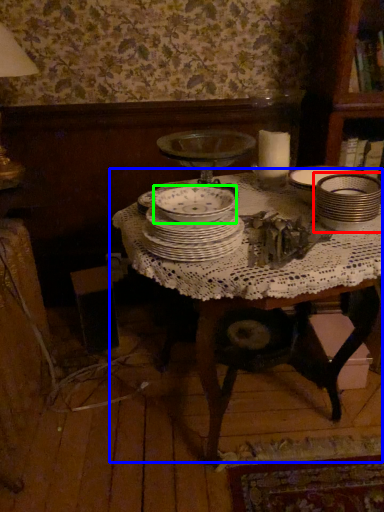
Question: Which object is positioned farthest from tableware (highlighted by a red box)? Select from table (highlighted by a blue box) and bowl (highlighted by a green box).

Choices:
 (A) table
 (B) bowl

Answer: (B)